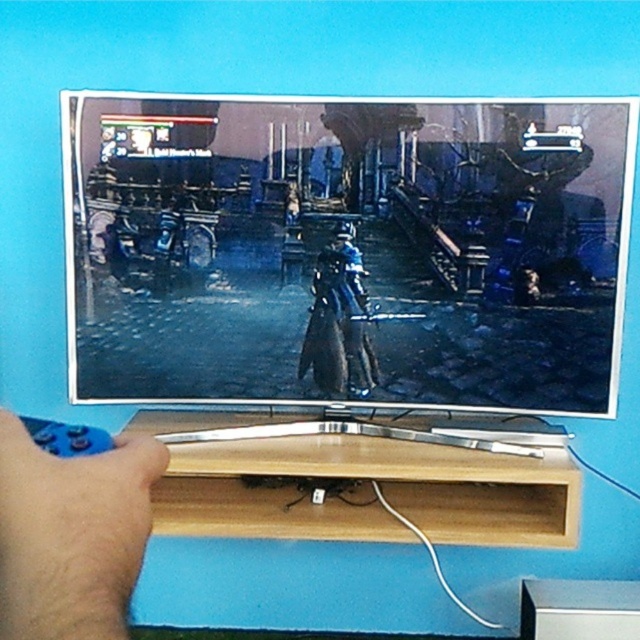
Between blue matte remote control at lower left and shiny blue armor at center, which one is positioned lower?

Positioned lower is blue matte remote control at lower left.

Who is positioned more to the left, blue matte remote control at lower left or shiny blue armor at center?

Positioned to the left is blue matte remote control at lower left.

The width and height of the screenshot is (640, 640). What are the coordinates of `blue matte remote control at lower left` in the screenshot? It's located at (72, 534).

Which of these two, shiny metallic sword at center or shiny blue armor at center, stands taller?

With more height is shiny metallic sword at center.

Between point (497, 298) and point (352, 353), which one is positioned behind?

Positioned behind is point (352, 353).

Locate an element on the screen. shiny metallic sword at center is located at coordinates (348, 250).

Can you confirm if shiny metallic sword at center is positioned above blue matte remote control at lower left?

Yes, shiny metallic sword at center is above blue matte remote control at lower left.

Is point (445, 326) positioned in front of point (26, 500)?

No, (445, 326) is further to viewer.

You are a GUI agent. You are given a task and a screenshot of the screen. Output one action in this format:
    pyautogui.click(x=<x>, y=<y>)
    Task: Click on the shiny metallic sword at center
    This screenshot has height=640, width=640.
    Given the screenshot: What is the action you would take?
    pyautogui.click(x=348, y=250)